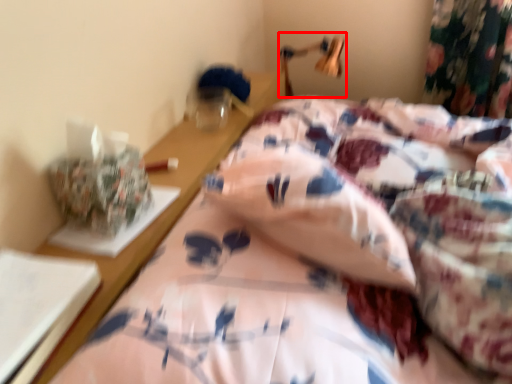
Question: From the image, what is the correct spatial relationship of table lamp (annotated by the red box) in relation to bed?

Choices:
 (A) left
 (B) right

Answer: (B)